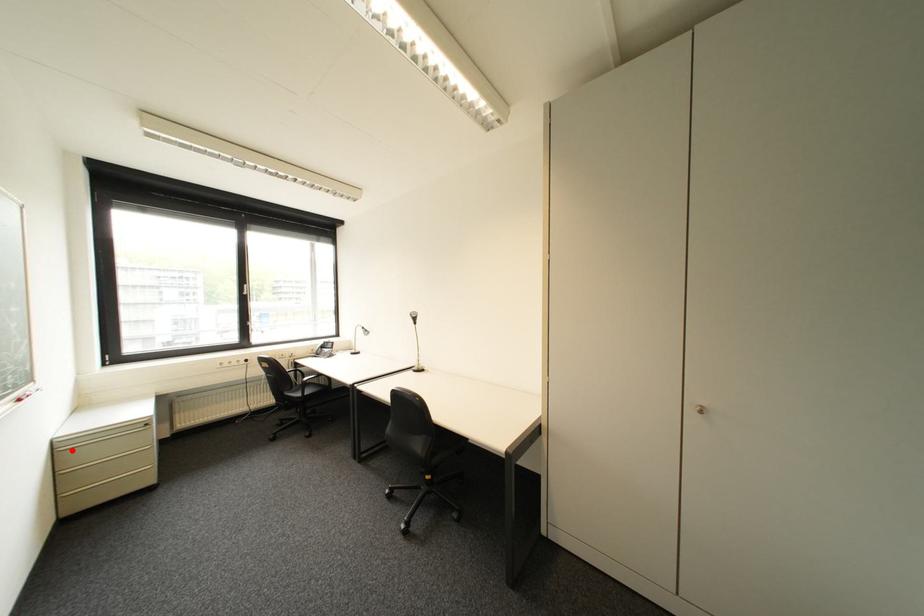
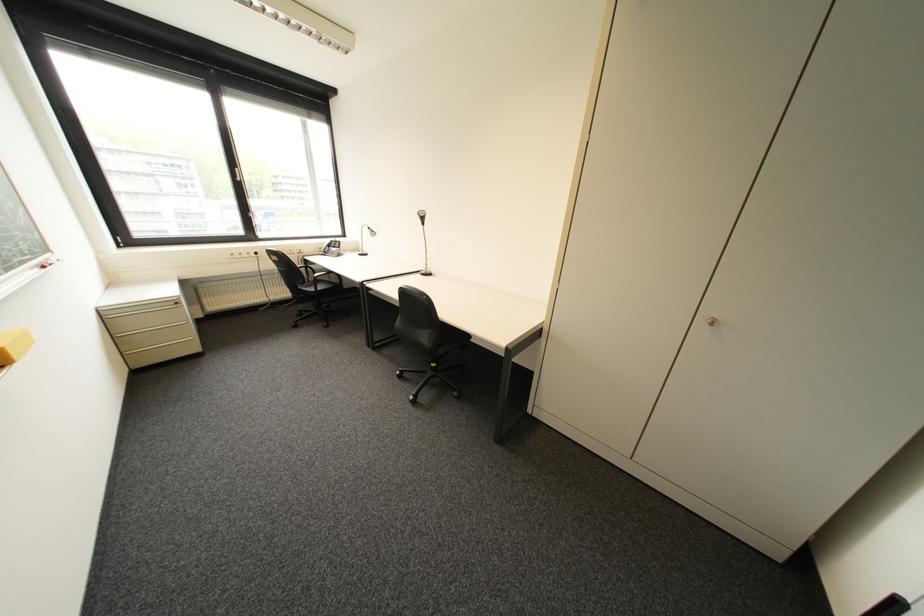
Where in the second image is the point corresponding to the highlighted location from the first image?

(119, 318)